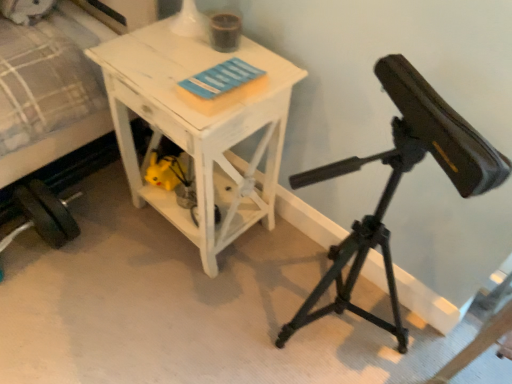
Question: Can you confirm if black matte tripod at right is bigger than white distressed wood table at center?

Choices:
 (A) yes
 (B) no

Answer: (A)

Question: Is the depth of black matte tripod at right less than that of white distressed wood table at center?

Choices:
 (A) no
 (B) yes

Answer: (B)

Question: Would you say black matte tripod at right is a long distance from white distressed wood table at center?

Choices:
 (A) no
 (B) yes

Answer: (A)

Question: Could you tell me if black matte tripod at right is turned towards white distressed wood table at center?

Choices:
 (A) no
 (B) yes

Answer: (A)

Question: Does black matte tripod at right have a greater width compared to white distressed wood table at center?

Choices:
 (A) no
 (B) yes

Answer: (B)

Question: From the image's perspective, is black matte tripod at right above or below white distressed wood table at center?

Choices:
 (A) below
 (B) above

Answer: (A)

Question: Which is correct: black matte tripod at right is inside white distressed wood table at center, or outside of it?

Choices:
 (A) outside
 (B) inside

Answer: (A)

Question: From their relative heights in the image, would you say black matte tripod at right is taller or shorter than white distressed wood table at center?

Choices:
 (A) short
 (B) tall

Answer: (B)

Question: Is black matte tripod at right to the left or to the right of white distressed wood table at center in the image?

Choices:
 (A) right
 (B) left

Answer: (A)

Question: Would you say black matte tripod at right is to the left or to the right of white fabric bed at left in the picture?

Choices:
 (A) left
 (B) right

Answer: (B)

Question: From a real-world perspective, relative to white fabric bed at left, is black matte tripod at right vertically above or below?

Choices:
 (A) above
 (B) below

Answer: (A)

Question: Is black matte tripod at right wider or thinner than white fabric bed at left?

Choices:
 (A) thin
 (B) wide

Answer: (A)

Question: Based on their sizes in the image, would you say black matte tripod at right is bigger or smaller than white fabric bed at left?

Choices:
 (A) small
 (B) big

Answer: (A)

Question: Looking at the image, does white fabric bed at left seem bigger or smaller compared to white distressed wood table at center?

Choices:
 (A) big
 (B) small

Answer: (A)

Question: From their relative heights in the image, would you say white fabric bed at left is taller or shorter than white distressed wood table at center?

Choices:
 (A) short
 (B) tall

Answer: (B)